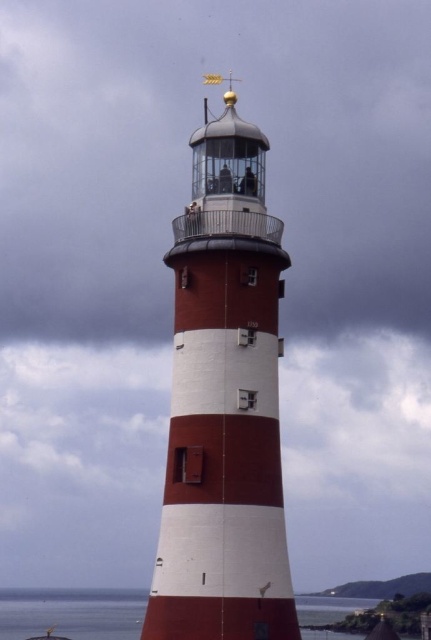
Is smooth white lighthouse at center to the left of transparent water at lower left from the viewer's perspective?

Indeed, smooth white lighthouse at center is positioned on the left side of transparent water at lower left.

Does smooth white lighthouse at center have a smaller size compared to transparent water at lower left?

Correct, smooth white lighthouse at center occupies less space than transparent water at lower left.

The height and width of the screenshot is (640, 431). Describe the element at coordinates (224, 404) in the screenshot. I see `smooth white lighthouse at center` at that location.

Where is `smooth white lighthouse at center`? smooth white lighthouse at center is located at coordinates click(x=224, y=404).